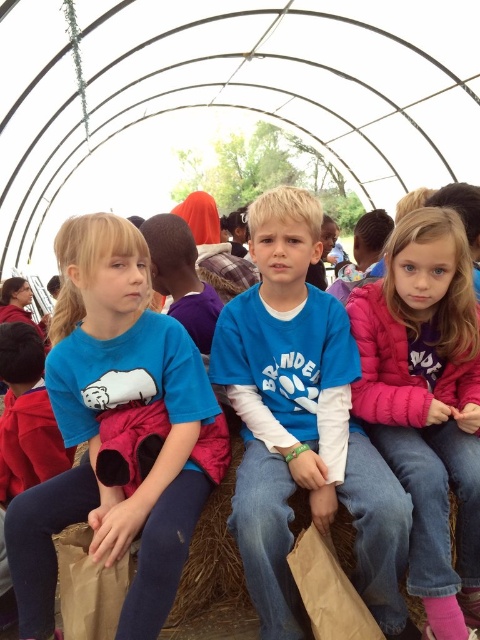
You are a photographer standing in front of the large curved structure. You need to take a photo of the blue cotton shirt at center and the brown paper bag at center. Which object should you focus on first if you want to capture both in the same frame without moving the camera?

The blue cotton shirt at center is taller than the brown paper bag at center, so you should focus on the blue cotton shirt at center first to ensure both are in the frame.